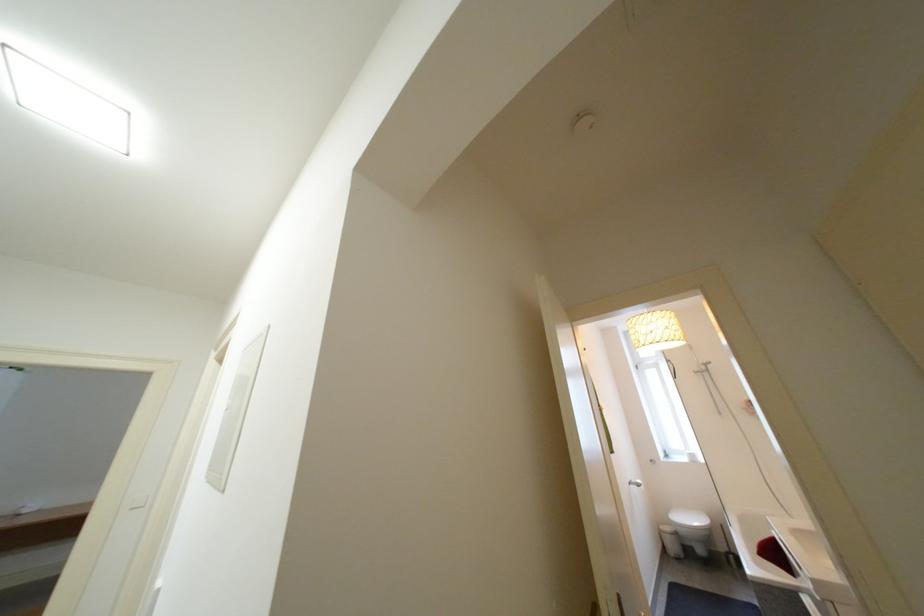
Where is `white light switch`? white light switch is located at coordinates (138, 501).